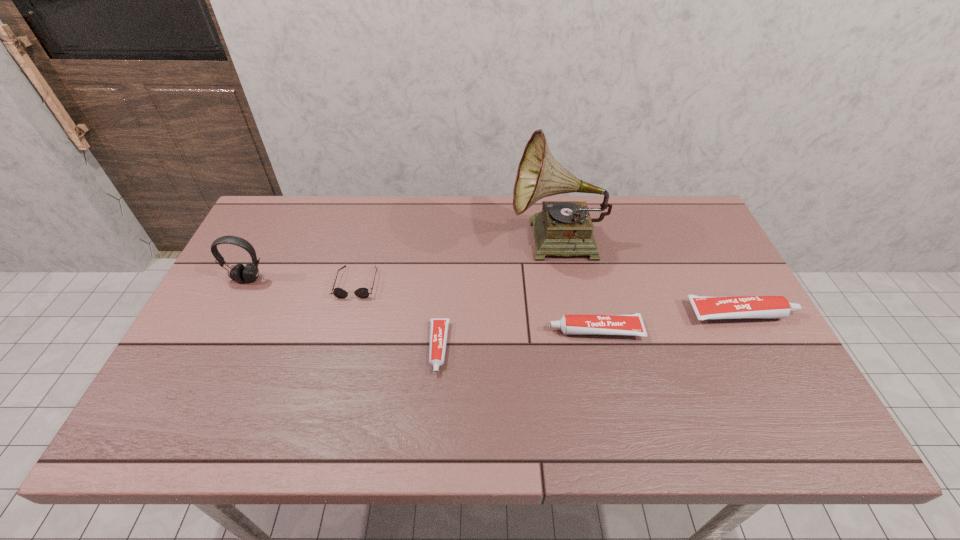
Find the location of a particular element. This screenshot has width=960, height=540. vacant point located 0.190m at the nozzle of the second toothpaste from right to left is located at coordinates (475, 330).

You are a GUI agent. You are given a task and a screenshot of the screen. Output one action in this format:
    pyautogui.click(x=<x>, y=<y>)
    Task: Click on the vacant area situated 0.250m at the nozzle of the second toothpaste from right to left
    This screenshot has height=540, width=960.
    Given the screenshot: What is the action you would take?
    pyautogui.click(x=452, y=330)

Identify the location of vacant space located at the nozzle of the second toothpaste from right to left. This screenshot has height=540, width=960. (479, 330).

You are a GUI agent. You are given a task and a screenshot of the screen. Output one action in this format:
    pyautogui.click(x=<x>, y=<y>)
    Task: Click on the free space located from the horn of the record player
    The image size is (960, 540).
    Given the screenshot: What is the action you would take?
    pyautogui.click(x=389, y=242)

The height and width of the screenshot is (540, 960). I want to click on free location located from the horn of the record player, so click(430, 242).

Where is `vacant area located 0.200m from the horn of the record player`? Image resolution: width=960 pixels, height=540 pixels. vacant area located 0.200m from the horn of the record player is located at coordinates (446, 242).

Locate an element on the screen. This screenshot has width=960, height=540. vacant space located 0.240m on the front-facing side of the second tallest object is located at coordinates (208, 356).

Identify the location of free spot located 0.240m on the front-facing side of the fifth object from right to left. (332, 375).

At what (x,y) coordinates should I click in order to perform the action: click on object that is at the far edge. Please return your answer as a coordinate pair (x, y). Looking at the image, I should click on (565, 228).

You are a GUI agent. You are given a task and a screenshot of the screen. Output one action in this format:
    pyautogui.click(x=<x>, y=<y>)
    Task: Click on the object present at the near edge
    
    Given the screenshot: What is the action you would take?
    pyautogui.click(x=438, y=326)